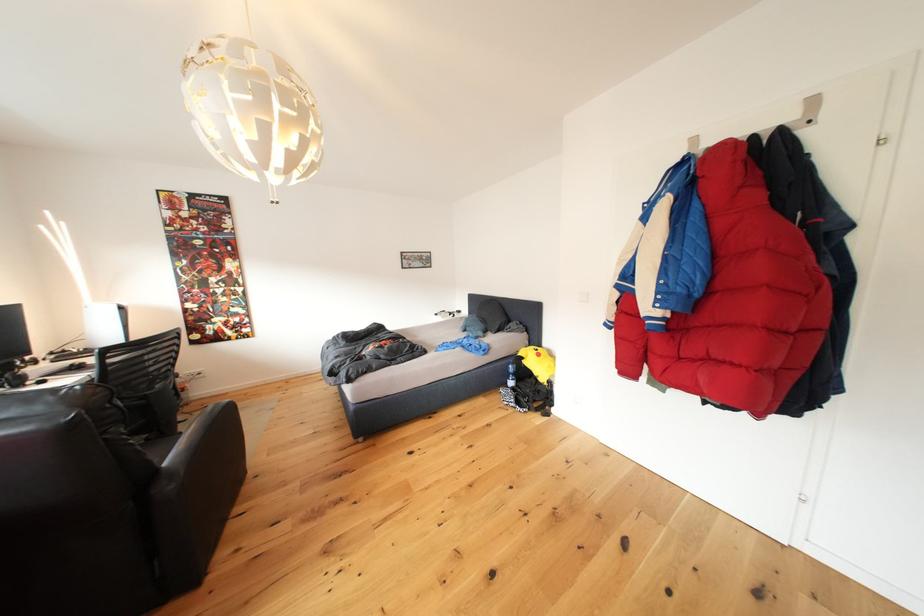
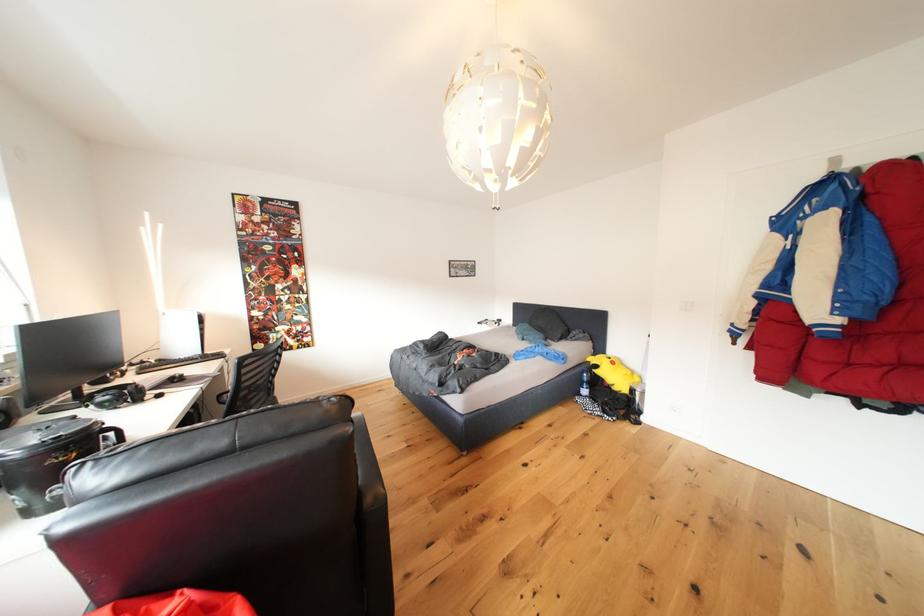
Question: The camera is either moving clockwise (left) or counter-clockwise (right) around the object. The first image is from the beginning of the video and the second image is from the end. Is the camera moving left or right when shooting the video?

Choices:
 (A) Left
 (B) Right

Answer: (A)